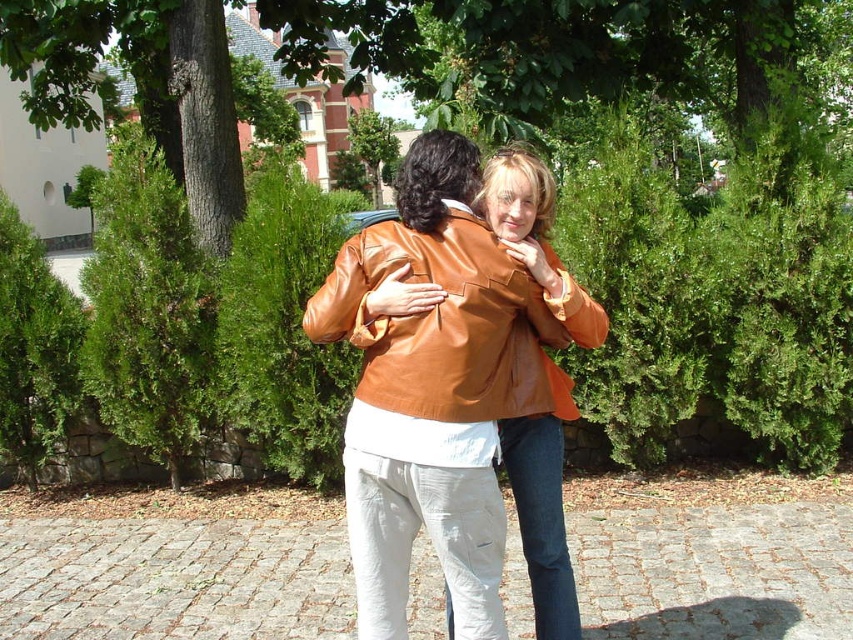
You are standing in a park and see the shiny orange jacket at center. If you want to take a photo of it from where you are standing, will the jacket be in focus if your camera has a depth of field that can focus on objects up to 10 feet away?

The shiny orange jacket at center is 8.75 feet away from the camera. Since your camera can focus up to 10 feet, the jacket will be in focus.

You are a fashion designer observing two jackets in the scene. The matte brown leather jacket at center and the shiny orange jacket at center. Which one has a bigger size?

The matte brown leather jacket at center has a larger size compared to the shiny orange jacket at center.

You are a photographer trying to capture the matte brown leather jacket at center in your shot. The camera you are using has a focal point at coordinates 0.5, 0.5. Will the jacket be in focus?

The matte brown leather jacket at center is located at point (437, 381), which is very close to the camera focal point at (426, 320). Therefore, the jacket will likely be in focus.